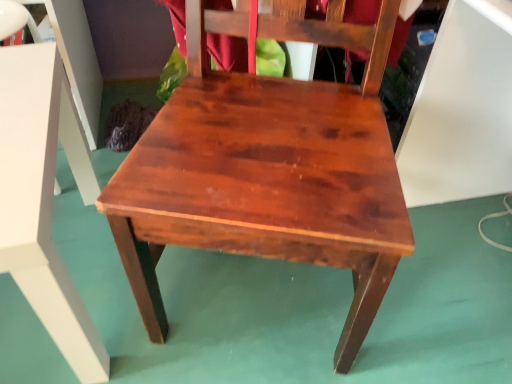
At what (x,y) coordinates should I click in order to perform the action: click on satin wood chair at center. Please return your answer as a coordinate pair (x, y). Looking at the image, I should click on (268, 168).

This screenshot has height=384, width=512. What do you see at coordinates (268, 168) in the screenshot?
I see `satin wood chair at center` at bounding box center [268, 168].

What is the approximate height of wooden table at center?

wooden table at center is 18.26 inches in height.

Describe the element at coordinates (44, 198) in the screenshot. I see `wooden table at center` at that location.

Identify the location of wooden table at center. The height and width of the screenshot is (384, 512). (44, 198).

You are a GUI agent. You are given a task and a screenshot of the screen. Output one action in this format:
    pyautogui.click(x=<x>, y=<y>)
    Task: Click on the satin wood chair at center
    
    Given the screenshot: What is the action you would take?
    pyautogui.click(x=268, y=168)

Which is more to the right, wooden table at center or satin wood chair at center?

Positioned to the right is satin wood chair at center.

Between wooden table at center and satin wood chair at center, which one is positioned in front?

satin wood chair at center.

Between point (20, 263) and point (198, 190), which one is positioned in front?

The point (20, 263) is closer.

From the image's perspective, which one is positioned higher, wooden table at center or satin wood chair at center?

satin wood chair at center, from the image's perspective.

From a real-world perspective, does wooden table at center sit lower than satin wood chair at center?

Yes, from a real-world perspective, wooden table at center is below satin wood chair at center.

Considering the relative sizes of wooden table at center and satin wood chair at center in the image provided, is wooden table at center thinner than satin wood chair at center?

Indeed, wooden table at center has a lesser width compared to satin wood chair at center.

Does wooden table at center have a greater height compared to satin wood chair at center?

No.

Does wooden table at center have a larger size compared to satin wood chair at center?

No.

Is wooden table at center located outside satin wood chair at center?

Yes, wooden table at center is outside of satin wood chair at center.

Is wooden table at center positioned far away from satin wood chair at center?

No, wooden table at center is in close proximity to satin wood chair at center.

Could you tell me if wooden table at center is turned towards satin wood chair at center?

No.

Can you tell me how much wooden table at center and satin wood chair at center differ in facing direction?

There is a 65-degree angle between the facing directions of wooden table at center and satin wood chair at center.

Identify the location of table to the left of satin wood chair at center. (44, 198).

Is satin wood chair at center to the right of wooden table at center from the viewer's perspective?

Yes.

Is satin wood chair at center closer to the viewer compared to wooden table at center?

Yes.

Which is closer to the camera, (x=160, y=301) or (x=36, y=93)?

Point (x=160, y=301) appears to be farther away from the viewer than point (x=36, y=93).

From the image's perspective, is satin wood chair at center located above or below wooden table at center?

From the image's perspective, satin wood chair at center appears above wooden table at center.

From a real-world perspective, which is physically below, satin wood chair at center or wooden table at center?

wooden table at center.

Which of these two, satin wood chair at center or wooden table at center, is wider?

Wider between the two is satin wood chair at center.

Between satin wood chair at center and wooden table at center, which one has more height?

satin wood chair at center.

Is satin wood chair at center bigger or smaller than wooden table at center?

In the image, satin wood chair at center appears to be larger than wooden table at center.

Is satin wood chair at center inside or outside of wooden table at center?

satin wood chair at center lies outside wooden table at center.

Is satin wood chair at center touching wooden table at center?

satin wood chair at center and wooden table at center are clearly separated.

Is satin wood chair at center facing away from wooden table at center?

That's not correct — satin wood chair at center is not looking away from wooden table at center.

The image size is (512, 384). Find the location of `table located underneath the satin wood chair at center (from a real-world perspective)`. table located underneath the satin wood chair at center (from a real-world perspective) is located at coordinates [44, 198].

Image resolution: width=512 pixels, height=384 pixels. I want to click on chair that appears above the wooden table at center (from a real-world perspective), so click(x=268, y=168).

Where is `table on the left of the satin wood chair at center`? Image resolution: width=512 pixels, height=384 pixels. table on the left of the satin wood chair at center is located at coordinates tap(44, 198).